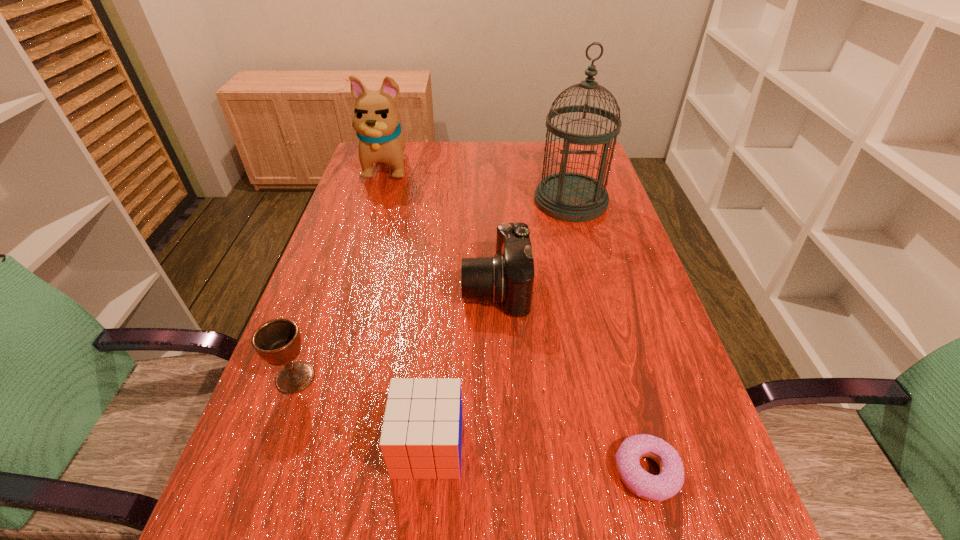
I want to click on the tallest object, so (x=567, y=196).

You are a GUI agent. You are given a task and a screenshot of the screen. Output one action in this format:
    pyautogui.click(x=<x>, y=<y>)
    Task: Click on the second tallest object
    The height and width of the screenshot is (540, 960).
    Given the screenshot: What is the action you would take?
    pyautogui.click(x=376, y=118)

This screenshot has width=960, height=540. I want to click on the third farthest object, so click(x=508, y=277).

Locate an element on the screen. The width and height of the screenshot is (960, 540). the fourth farthest object is located at coordinates (278, 341).

Locate an element on the screen. This screenshot has height=540, width=960. cube is located at coordinates (421, 438).

Where is `the shortest object`? the shortest object is located at coordinates (668, 483).

At what (x,y) coordinates should I click in order to perform the action: click on vacant area situated on the front-facing side of the tallest object. Please return your answer as a coordinate pair (x, y). Looking at the image, I should click on (588, 266).

Locate an element on the screen. vacant space located 0.110m on the face of the fifth shortest object is located at coordinates (375, 206).

At what (x,y) coordinates should I click in order to perform the action: click on vacant space located on the lens of the third farthest object. Please return your answer as a coordinate pair (x, y). Looking at the image, I should click on (428, 287).

Find the location of a particular element. vacant space located 0.130m on the lens of the third farthest object is located at coordinates (407, 287).